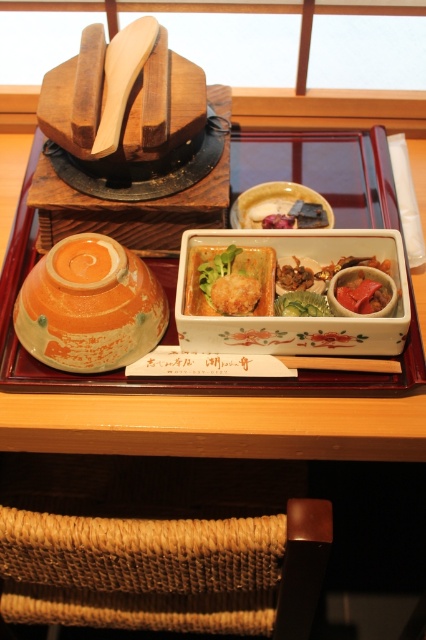
Is matte orange bowl at left positioned in front of green leafy vegetable at center?

Yes, it is in front of green leafy vegetable at center.

Describe the element at coordinates (89, 307) in the screenshot. This screenshot has height=640, width=426. I see `matte orange bowl at left` at that location.

Where is `matte orange bowl at left`? This screenshot has width=426, height=640. matte orange bowl at left is located at coordinates (89, 307).

Between matte brown rectangular dish at center and green leafy vegetable at center, which one has more height?

With more height is matte brown rectangular dish at center.

Which is behind, point (212, 289) or point (310, 307)?

The point (212, 289) is more distant.

The image size is (426, 640). What do you see at coordinates (235, 292) in the screenshot? I see `matte brown rectangular dish at center` at bounding box center [235, 292].

Locate an element on the screen. matte brown rectangular dish at center is located at coordinates (235, 292).

Who is more forward, (319, 362) or (290, 304)?

Point (319, 362) is more forward.

How much distance is there between wooden chopsticks at center and green leafy vegetable at center?

wooden chopsticks at center is 3.64 inches from green leafy vegetable at center.

The image size is (426, 640). Identify the location of wooden chopsticks at center. (342, 364).

Identify the location of wooden chopsticks at center. This screenshot has width=426, height=640. (342, 364).